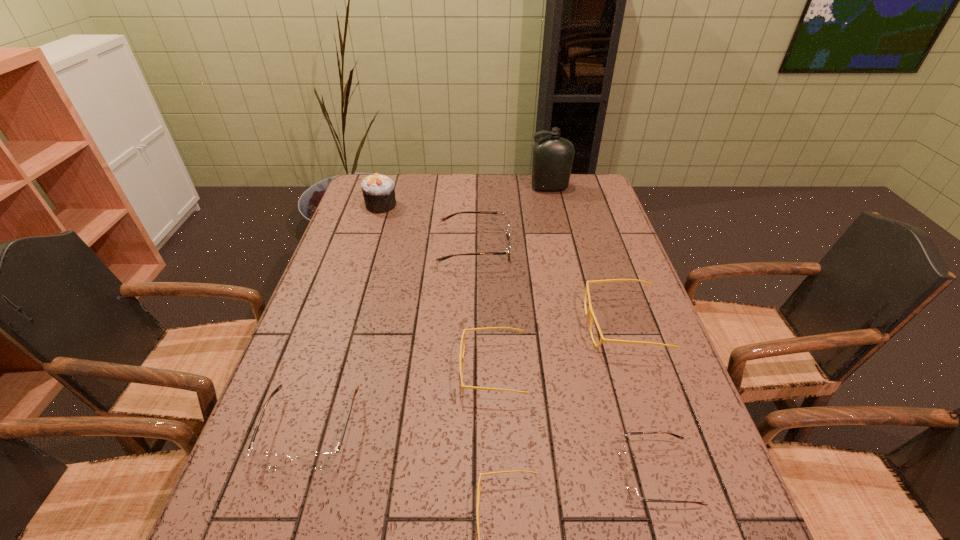
This screenshot has height=540, width=960. I want to click on the tallest object, so click(x=553, y=156).

The image size is (960, 540). I want to click on the farthest object, so click(x=553, y=156).

I want to click on cupcake, so click(378, 190).

I want to click on the second tallest object, so click(378, 190).

Identify the location of the third farthest object. (508, 232).

This screenshot has height=540, width=960. I want to click on the farthest spectacles, so click(508, 232).

In order to click on the biggest beige spectacles in this screenshot , I will do `click(590, 311)`.

In order to click on the leftmost brown spectacles in this screenshot , I will do pyautogui.click(x=322, y=460).

Locate an element on the screen. Image resolution: width=960 pixels, height=540 pixels. the second smallest brown spectacles is located at coordinates (322, 460).

Locate an element on the screen. This screenshot has width=960, height=540. the second smallest beige spectacles is located at coordinates (488, 328).